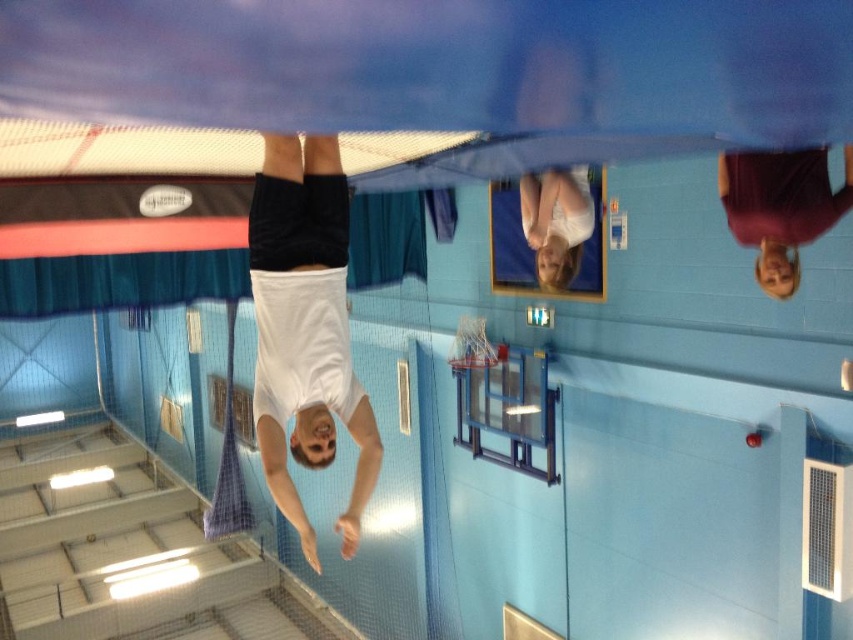
You are a photographer trying to capture both the white matte shirt at center and the maroon fabric shirt at upper right in a single shot. Based on their positions and sizes, which shirt should you focus on first to ensure both are in frame?

The white matte shirt at center has a greater height compared to the maroon fabric shirt at upper right, so focusing on the white matte shirt at center first would help ensure both are in frame since it occupies more space.

You are designing a new layout for the trampoline park and need to ensure that the white matte shirt at center and the white fabric at upper center are visible to all visitors. Considering their sizes, which object should be placed closer to the entrance to ensure visibility?

The white fabric at upper center should be placed closer to the entrance because it is wider than the white matte shirt at center, making it more noticeable from a distance.